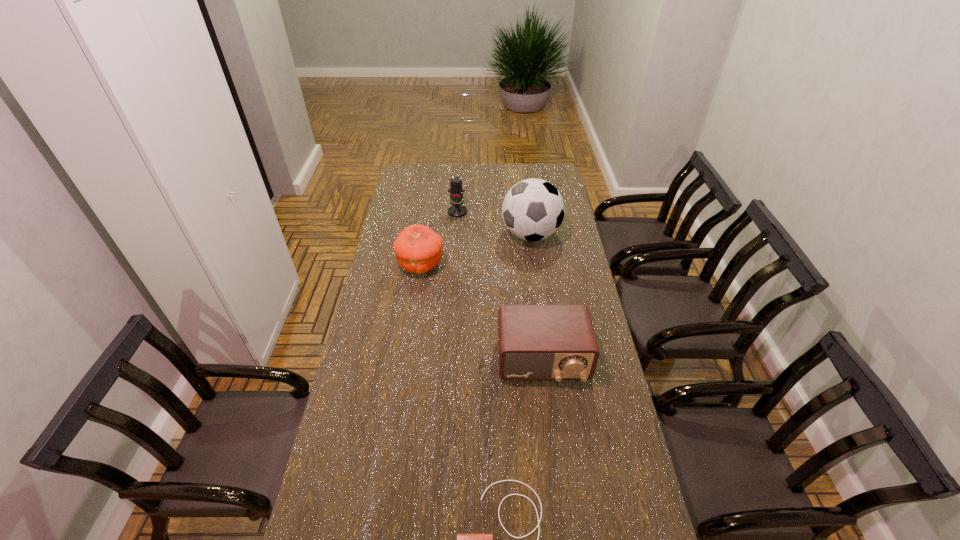
Where is `vacant area situated 0.310m on the front panel of the taller radio receiver`? vacant area situated 0.310m on the front panel of the taller radio receiver is located at coordinates (559, 483).

Locate an element on the screen. The width and height of the screenshot is (960, 540). object situated at the left edge is located at coordinates [418, 248].

At what (x,y) coordinates should I click in order to perform the action: click on soccer ball that is at the right edge. Please return your answer as a coordinate pair (x, y). Looking at the image, I should click on (533, 209).

Find the location of a particular element. This screenshot has height=540, width=960. radio receiver that is positioned at the right edge is located at coordinates (535, 342).

Where is `vacant space at the far edge of the desktop`? The width and height of the screenshot is (960, 540). vacant space at the far edge of the desktop is located at coordinates (447, 183).

Locate an element on the screen. vacant point at the right edge is located at coordinates (570, 241).

Where is `vacant area at the far left corner of the desktop`? vacant area at the far left corner of the desktop is located at coordinates tap(407, 185).

You are a GUI agent. You are given a task and a screenshot of the screen. Output one action in this format:
    pyautogui.click(x=<x>, y=<y>)
    Task: Click on the free space at the far right corner of the desktop
    The image size is (960, 540).
    Given the screenshot: What is the action you would take?
    pyautogui.click(x=533, y=178)

Locate an element on the screen. The width and height of the screenshot is (960, 540). free space between the microphone and the soccer ball is located at coordinates (494, 223).

This screenshot has height=540, width=960. I want to click on free space between the microphone and the farther radio receiver, so pos(500,286).